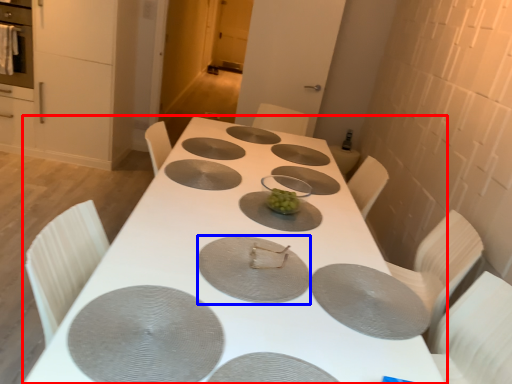
Question: Among these objects, which one is farthest to the camera, table (highlighted by a red box) or pizza pan (highlighted by a blue box)?

Choices:
 (A) table
 (B) pizza pan

Answer: (B)